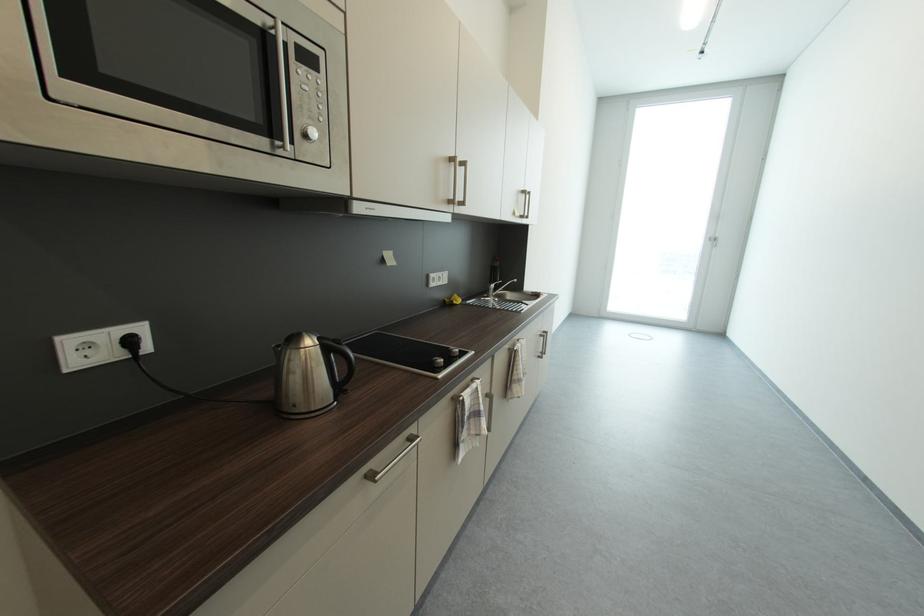
This screenshot has width=924, height=616. Describe the element at coordinates (310, 134) in the screenshot. I see `a microwave open button` at that location.